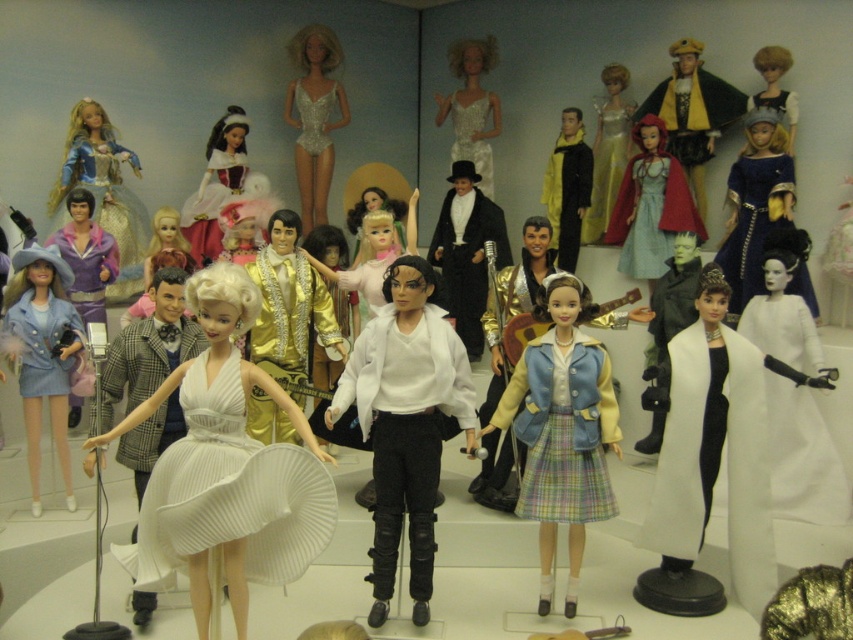
From the picture: You are a visitor at the doll exhibition and want to take a photo of the denim jacket at center and the matte silver dress at upper left. Which one should you focus on first to ensure both are in the frame?

Result: The denim jacket at center is in front of the matte silver dress at upper left, so you should focus on the denim jacket at center first to ensure both are in the frame.